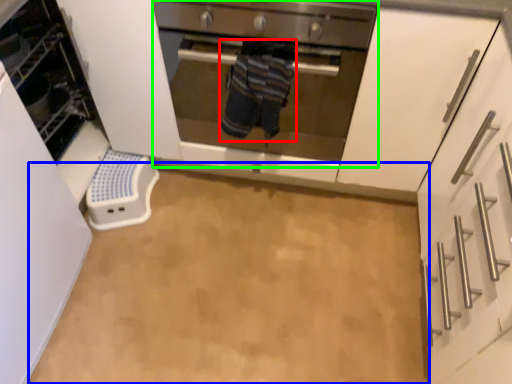
Question: Which object is positioned farthest from person (highlighted by a red box)? Select from plain (highlighted by a blue box) and oven (highlighted by a green box).

Choices:
 (A) plain
 (B) oven

Answer: (A)